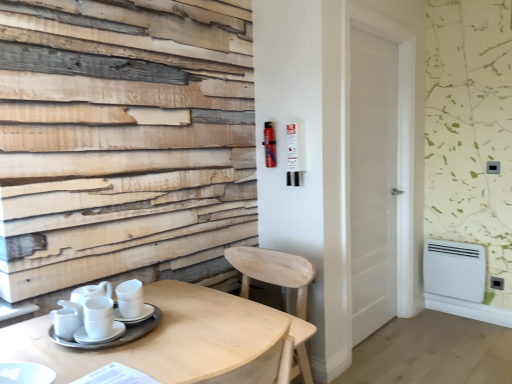
You are a GUI agent. You are given a task and a screenshot of the screen. Output one action in this format:
    pyautogui.click(x=<x>, y=<y>)
    Task: Click on the free point above light wood table at lower left (from a real-world perspective)
    The image size is (512, 384).
    Given the screenshot: What is the action you would take?
    pyautogui.click(x=160, y=340)